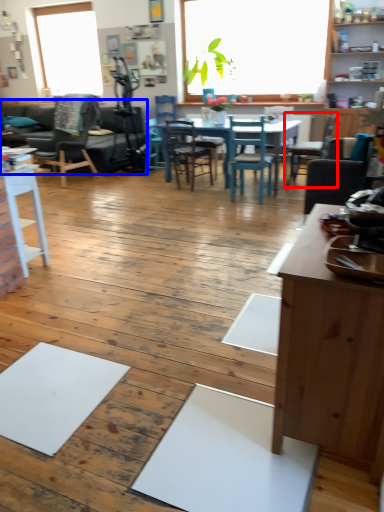
Question: Which of the following is the farthest to the observer, chair (highlighted by a red box) or couch (highlighted by a blue box)?

Choices:
 (A) chair
 (B) couch

Answer: (B)